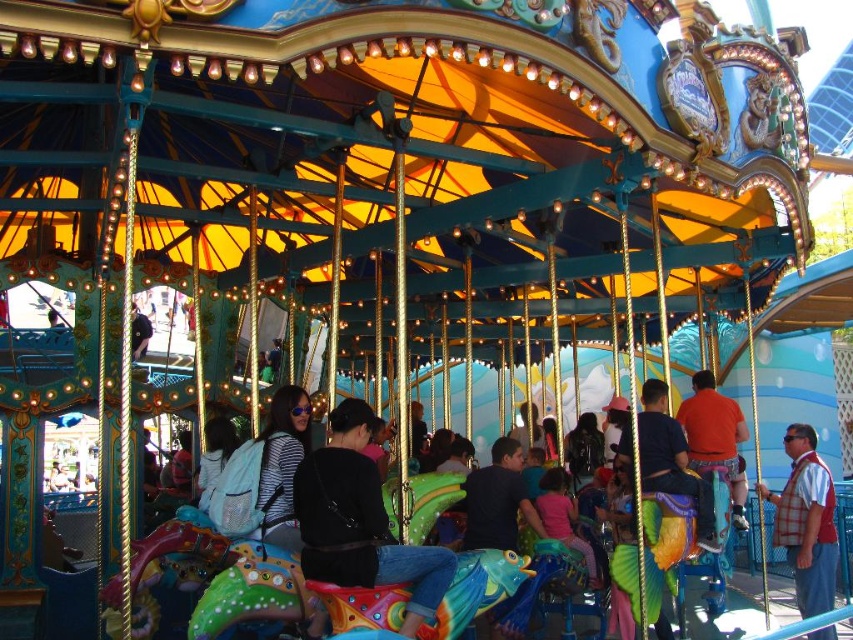
You are standing in front of the carousel and notice two items at the center. The black matte jacket at center and the pink fabric at center. Which one is taller?

The black matte jacket at center is taller than the pink fabric at center.

You are standing at the center of the carousel and see the point marked at coordinates (805, 522). What object is located at that point?

The point at coordinates (805, 522) indicates the plaid fabric vest at lower right.

You are standing in front of the carousel and notice two points marked on the structure. The first point is at coordinates point (692, 444) and the second is at point (570, 540). Which point is closer to you?

Point (692, 444) is further to the camera than point (570, 540), so the point closer to you is point (570, 540).